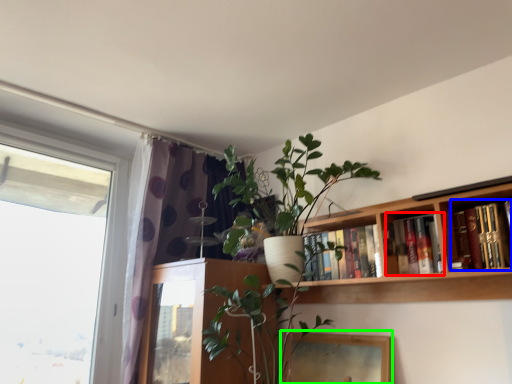
Question: Which is nearer to the book (highlighted by a red box)? book (highlighted by a blue box) or picture frame (highlighted by a green box).

Choices:
 (A) book
 (B) picture frame

Answer: (A)